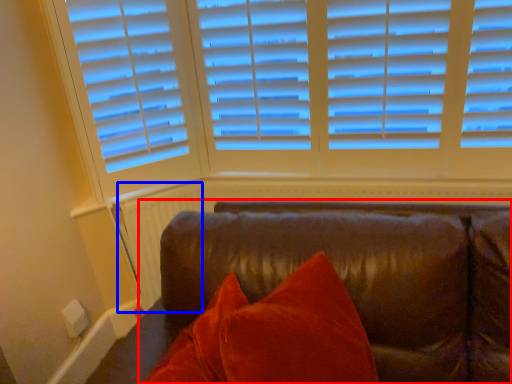
Question: Which object is further to the camera taking this photo, studio couch (highlighted by a red box) or radiator (highlighted by a blue box)?

Choices:
 (A) studio couch
 (B) radiator

Answer: (B)